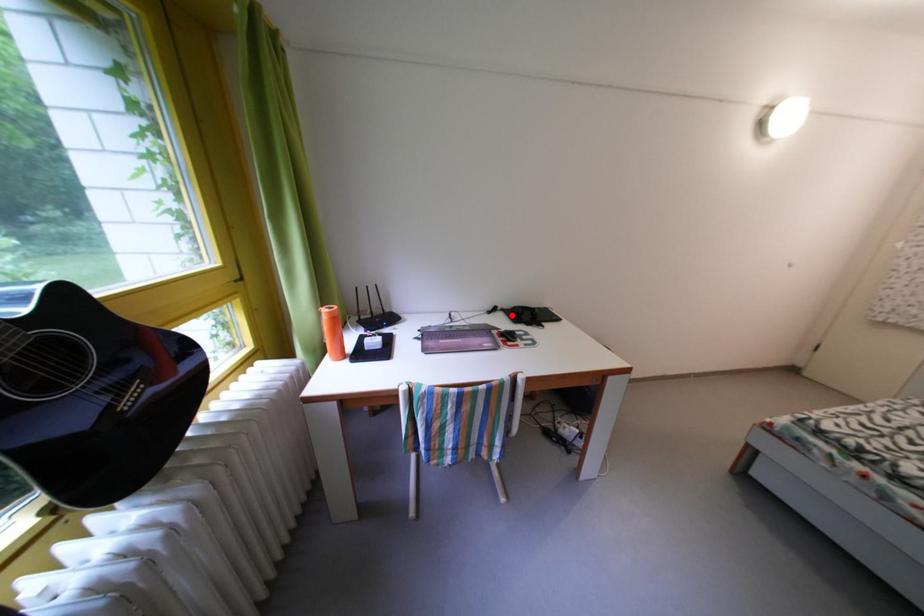
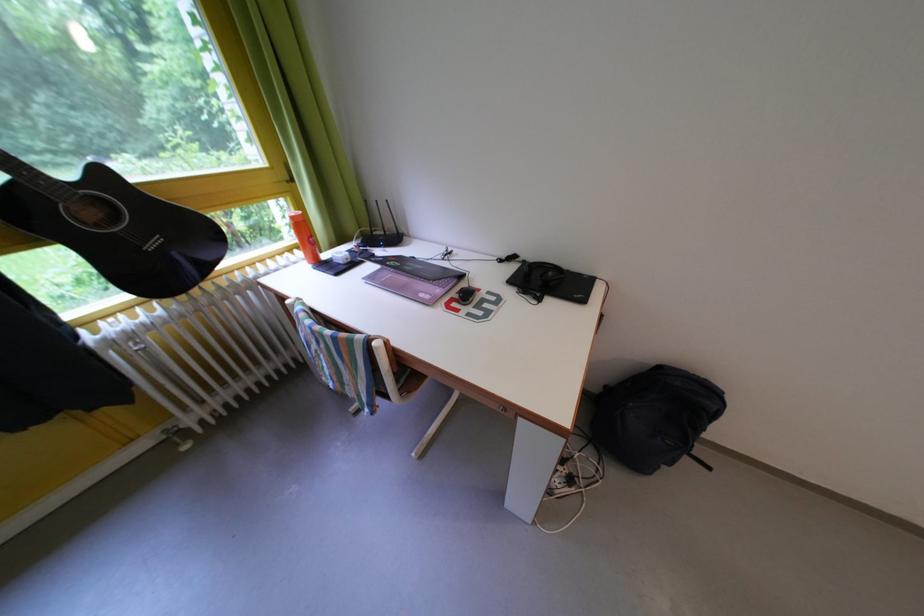
The point at the highlighted location is marked in the first image. Where is the corresponding point in the second image?

(533, 267)